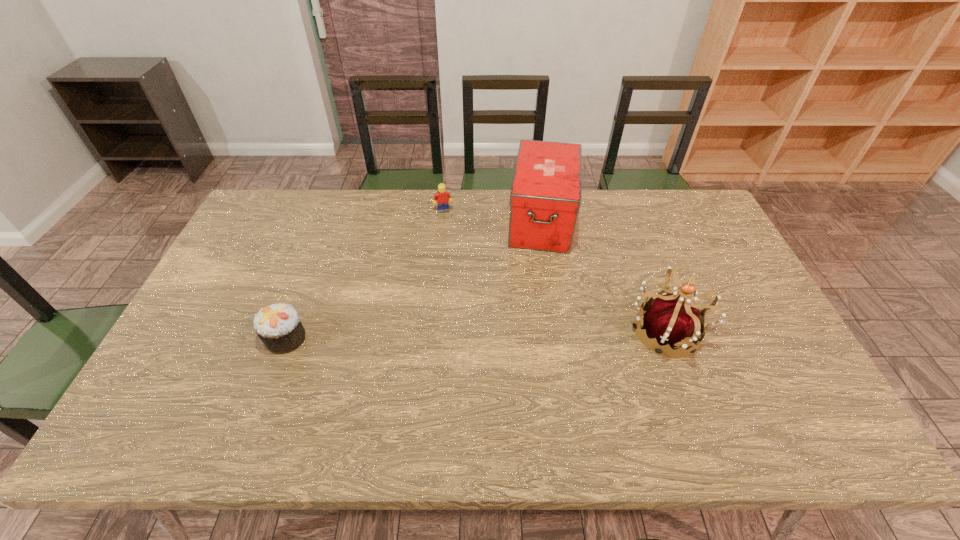
The height and width of the screenshot is (540, 960). I want to click on vacant space located on the handle side of the second object from right to left, so coord(532,344).

In order to click on free point located on the handle side of the second object from right to left in this screenshot , I will do `click(539, 281)`.

Find the location of a particular element. The image size is (960, 540). Lego at the far edge is located at coordinates (441, 196).

Identify the location of the first-aid kit located in the far edge section of the desktop. The image size is (960, 540). (545, 197).

Find the location of `vacant space at the far edge`. vacant space at the far edge is located at coordinates (491, 192).

Image resolution: width=960 pixels, height=540 pixels. In the image, there is a desktop. In order to click on blank space at the near edge in this screenshot , I will do `click(283, 377)`.

Identify the location of vacant space at the left edge of the desktop. (232, 276).

The height and width of the screenshot is (540, 960). In the image, there is a desktop. Find the location of `free space at the right edge`. free space at the right edge is located at coordinates (733, 302).

Identify the location of vacant position at the far left corner of the desktop. This screenshot has height=540, width=960. (254, 208).

At what (x,y) coordinates should I click in order to perform the action: click on free space at the near left corner of the desktop. Please return your answer as a coordinate pair (x, y). Image resolution: width=960 pixels, height=540 pixels. Looking at the image, I should click on (150, 399).